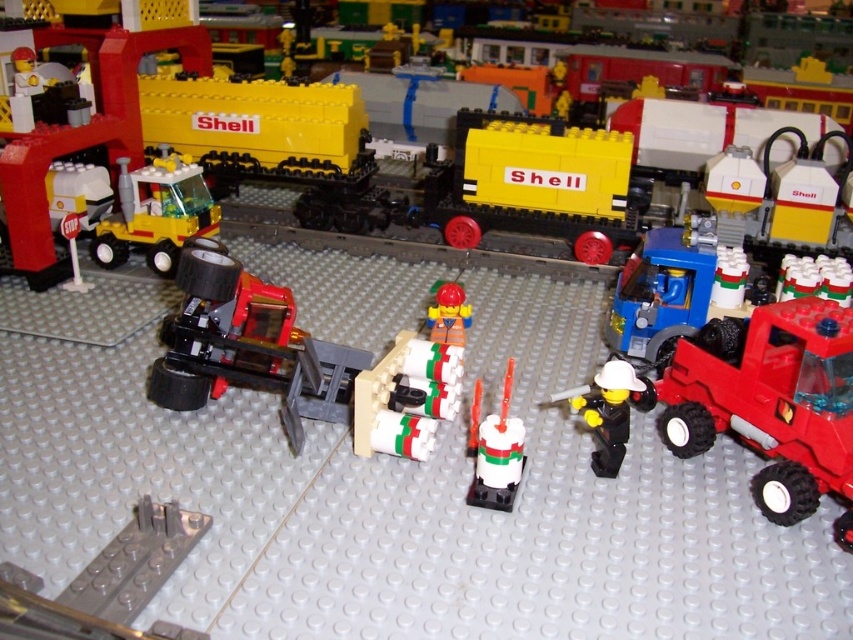
Does black matte figure at center have a lesser width compared to smooth plastic construction worker at center?

No, black matte figure at center is not thinner than smooth plastic construction worker at center.

This screenshot has width=853, height=640. Identify the location of black matte figure at center. (606, 412).

This screenshot has width=853, height=640. What do you see at coordinates (606, 412) in the screenshot?
I see `black matte figure at center` at bounding box center [606, 412].

This screenshot has height=640, width=853. I want to click on black matte figure at center, so click(x=606, y=412).

Identify the location of matte yellow truck at left. The width and height of the screenshot is (853, 640). (155, 212).

Is point (155, 160) positioned in front of point (450, 291)?

No, (155, 160) is behind (450, 291).

Locate an element on the screen. This screenshot has height=640, width=853. matte yellow truck at left is located at coordinates (155, 212).

I want to click on matte yellow truck at left, so click(155, 212).

Describe the element at coordinates (770, 403) in the screenshot. I see `rubberized red truck at right` at that location.

Between point (665, 374) and point (190, 173), which one is positioned behind?

Point (190, 173)

Which is in front, point (822, 340) or point (126, 180)?

Point (822, 340) is in front.

I want to click on rubberized red truck at right, so click(x=770, y=403).